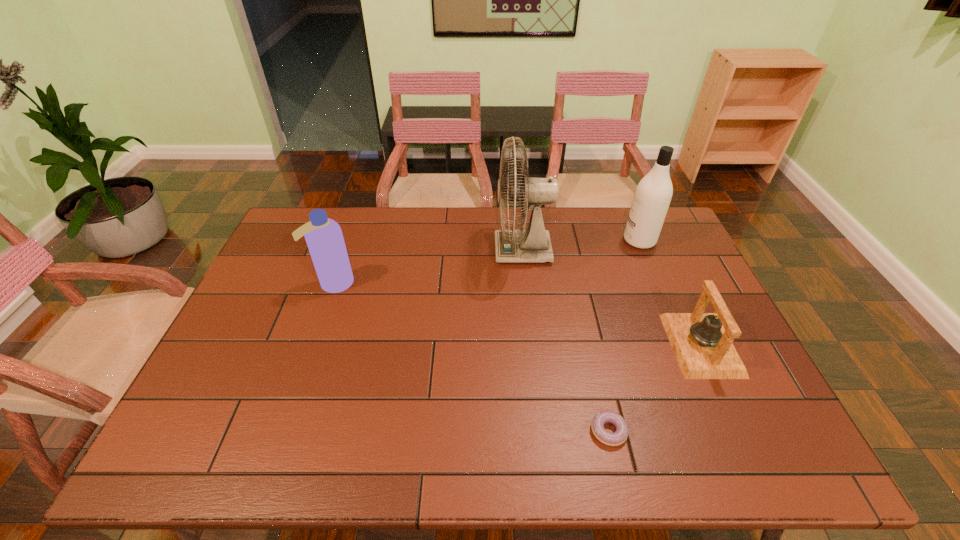
The height and width of the screenshot is (540, 960). I want to click on object located at the near edge, so click(x=617, y=438).

Where is `shampoo present at the right edge`? The image size is (960, 540). shampoo present at the right edge is located at coordinates (653, 194).

Locate an element on the screen. This screenshot has height=540, width=960. bell present at the right edge is located at coordinates (702, 343).

This screenshot has width=960, height=540. Find the location of `object located in the far right corner section of the desktop`. object located in the far right corner section of the desktop is located at coordinates (653, 194).

The image size is (960, 540). I want to click on vacant area at the far edge, so click(614, 228).

This screenshot has height=540, width=960. In order to click on vacant space at the near edge of the desktop in this screenshot , I will do `click(361, 433)`.

In the image, there is a desktop. Where is `vacant space at the left edge`? Image resolution: width=960 pixels, height=540 pixels. vacant space at the left edge is located at coordinates (262, 296).

In the image, there is a desktop. In order to click on vacant space at the right edge in this screenshot , I will do `click(735, 342)`.

Find the location of a particular element. free point between the third tallest object and the second object from left to right is located at coordinates (428, 267).

Locate an element on the screen. The width and height of the screenshot is (960, 540). vacant region between the third object from right to left and the leftmost object is located at coordinates (471, 357).